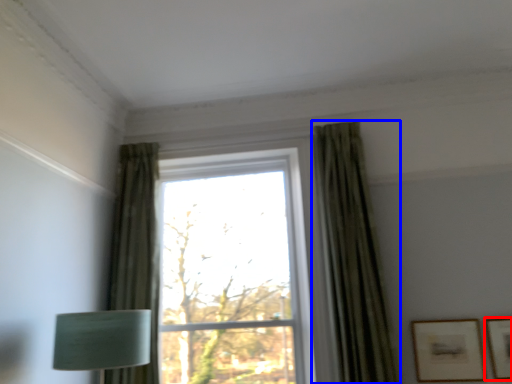
Question: Which object appears closest to the camera in this image, picture frame (highlighted by a red box) or curtain (highlighted by a blue box)?

Choices:
 (A) picture frame
 (B) curtain

Answer: (B)